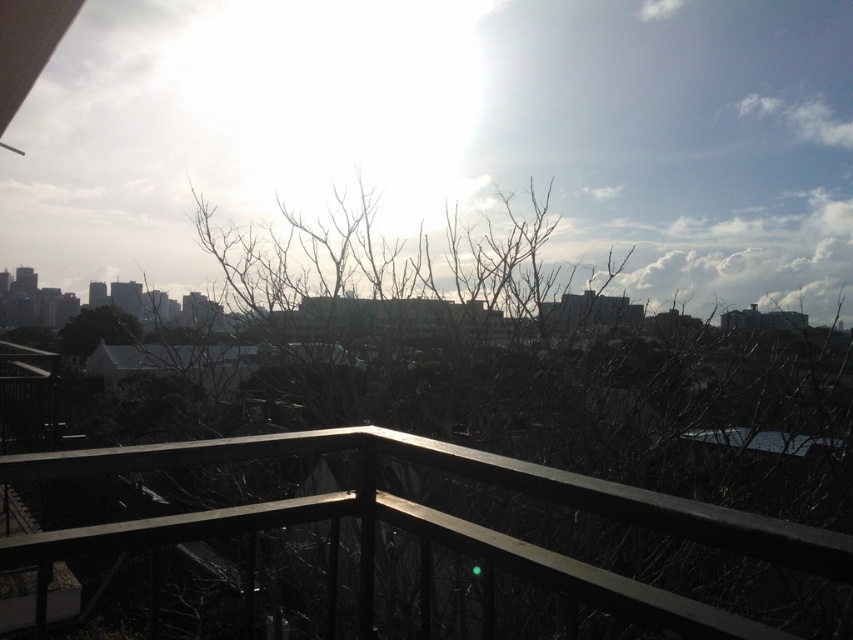
You are a drone operator trying to capture a photo of the black metal balustrade at center and the green matte tree at center from above. The drone has a maximum camera range of 20 meters. Can you capture both objects in a single photo without moving the drone?

The distance between the black metal balustrade at center and the green matte tree at center is 21.39 meters, which exceeds the drone camera range of 20 meters. Therefore, the drone cannot capture both objects in a single photo without moving.

You are standing on a balcony and want to take a photo of the cityscape. You have a camera that requires the subject to be at least 36 inches away to focus properly. Is the black metal balustrade at center in the way of your shot?

The black metal balustrade at center is only 34.28 inches away from the camera, which is closer than the required 36 inches. This means the balustrade is too close for the camera to focus properly, so it would obstruct the shot.